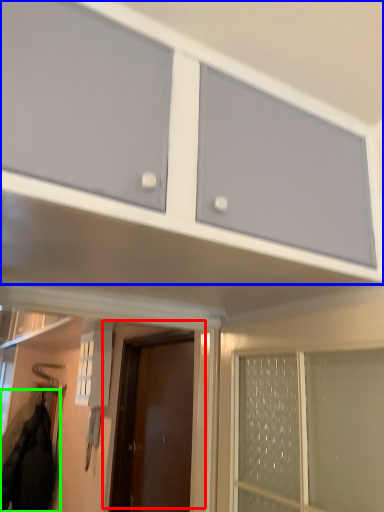
Question: Which is farther away from door (highlighted by a red box)? cabinetry (highlighted by a blue box) or jacket (highlighted by a green box)?

Choices:
 (A) cabinetry
 (B) jacket

Answer: (A)